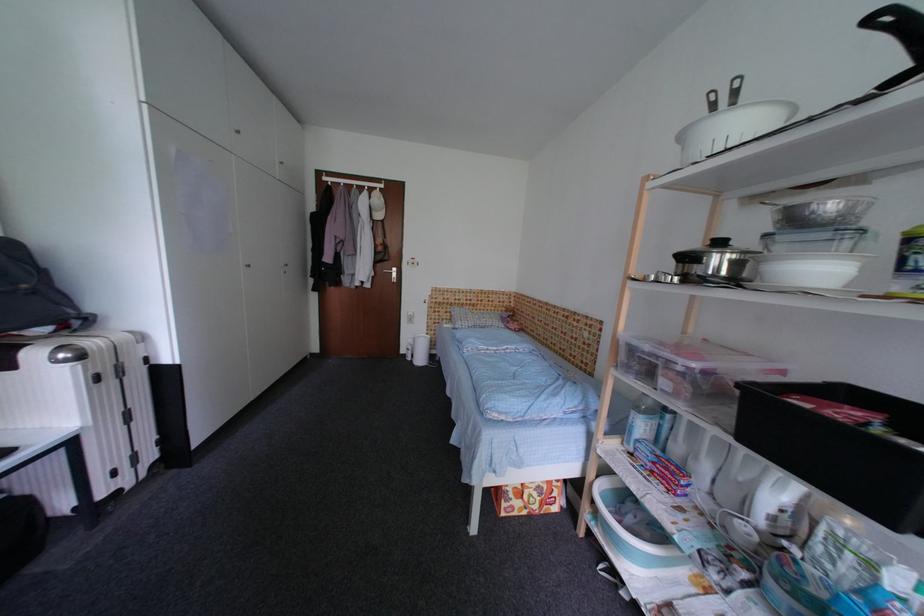
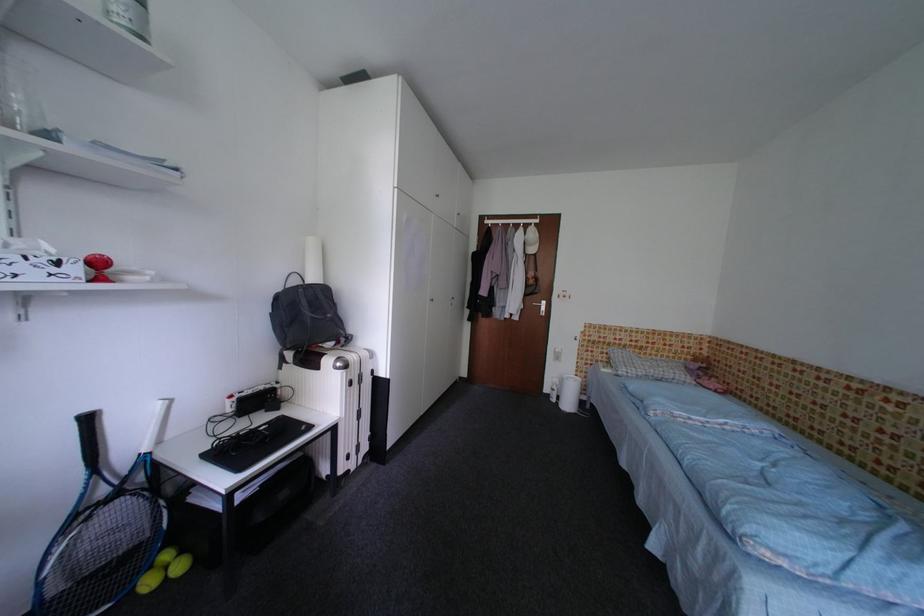
Where in the second image is the point corresponding to (x=104, y=381) from the first image?

(359, 386)